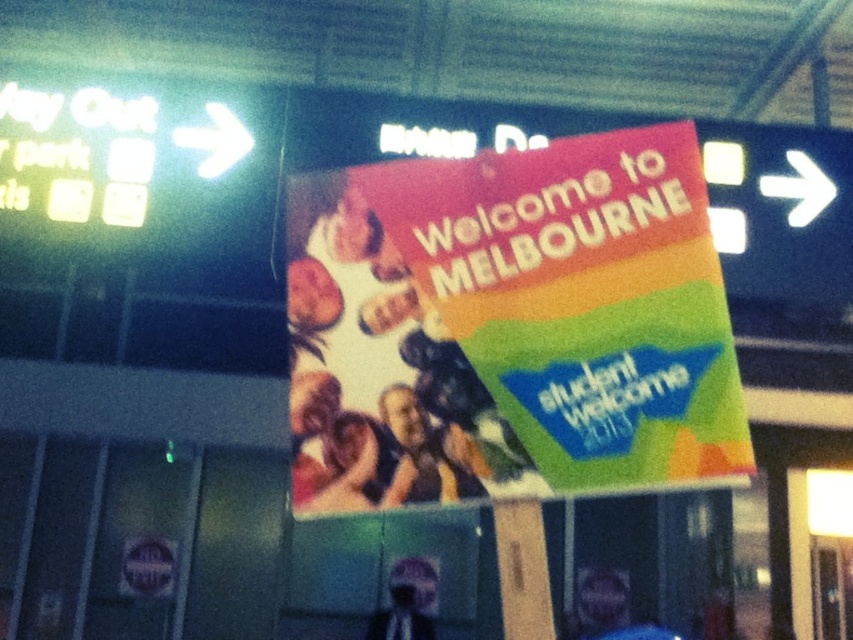
Question: From the image, what is the correct spatial relationship of matte plastic poster at center in relation to silvery metallic helmet at center?

Choices:
 (A) left
 (B) right

Answer: (B)

Question: Which object appears closest to the camera in this image?

Choices:
 (A) silvery metallic helmet at center
 (B) matte plastic poster at center

Answer: (B)

Question: Can you confirm if matte plastic poster at center is positioned to the right of silvery metallic helmet at center?

Choices:
 (A) yes
 (B) no

Answer: (A)

Question: Which point is closer to the camera?

Choices:
 (A) (410, 582)
 (B) (410, 376)

Answer: (B)

Question: Is matte plastic poster at center thinner than silvery metallic helmet at center?

Choices:
 (A) yes
 (B) no

Answer: (B)